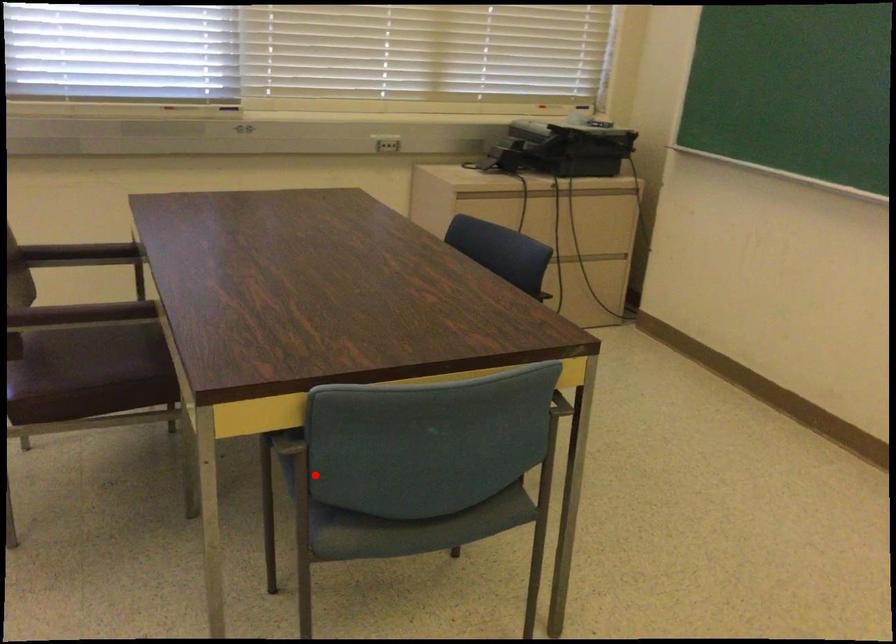
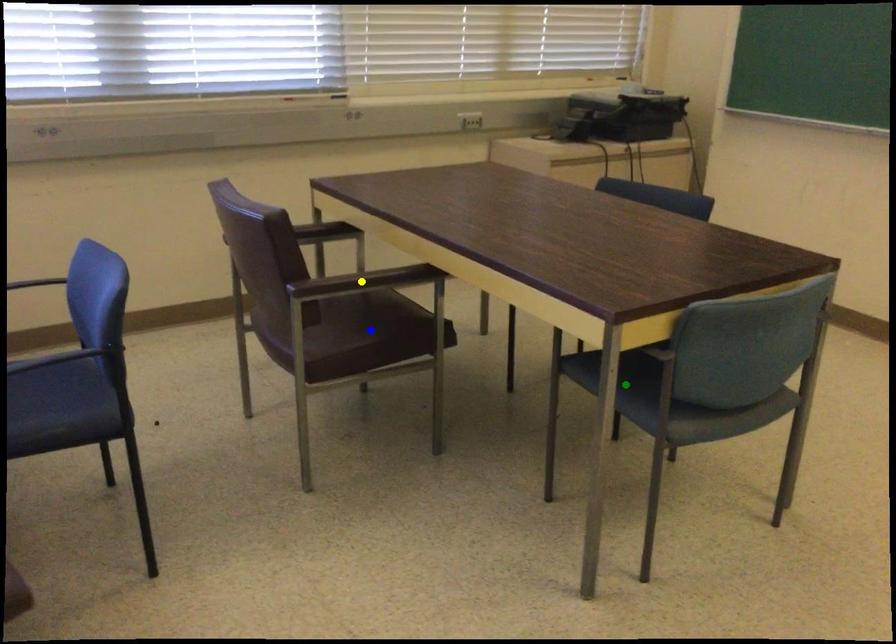
Question: I am providing you with two images of the same scene from different viewpoints. A red point is marked on the first image. You are given multiple points on the second image. Which spot in image 2 lines up with the point in image 1?

Choices:
 (A) blue point
 (B) green point
 (C) yellow point

Answer: (B)